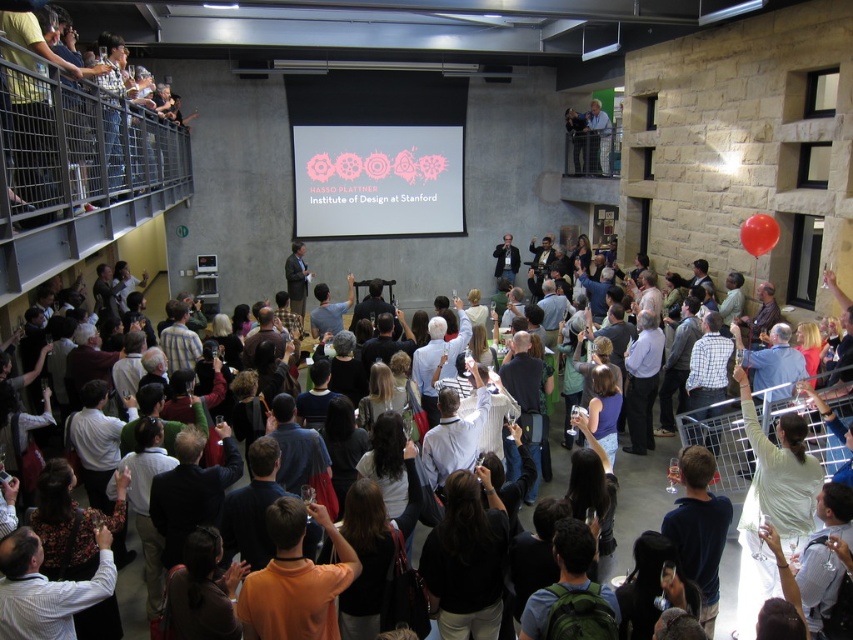
Question: Does matte black laptop at center appear over light blue shirt at upper center?

Choices:
 (A) yes
 (B) no

Answer: (B)

Question: Based on their relative distances, which object is farther from the matte black laptop at center?

Choices:
 (A) pink fabric projection screen at center
 (B) light blue shirt at upper center

Answer: (A)

Question: Which of the following is the closest to the observer?

Choices:
 (A) red rubber balloon at upper right
 (B) matte black laptop at center
 (C) light blue shirt at upper center

Answer: (B)

Question: Considering the real-world distances, which object is farthest from the red rubber balloon at upper right?

Choices:
 (A) pink fabric projection screen at center
 (B) matte black laptop at center
 (C) light blue shirt at upper center

Answer: (A)

Question: Can you confirm if pink fabric projection screen at center is positioned to the left of red rubber balloon at upper right?

Choices:
 (A) no
 (B) yes

Answer: (B)

Question: Can you confirm if pink fabric projection screen at center is positioned to the left of red rubber balloon at upper right?

Choices:
 (A) yes
 (B) no

Answer: (A)